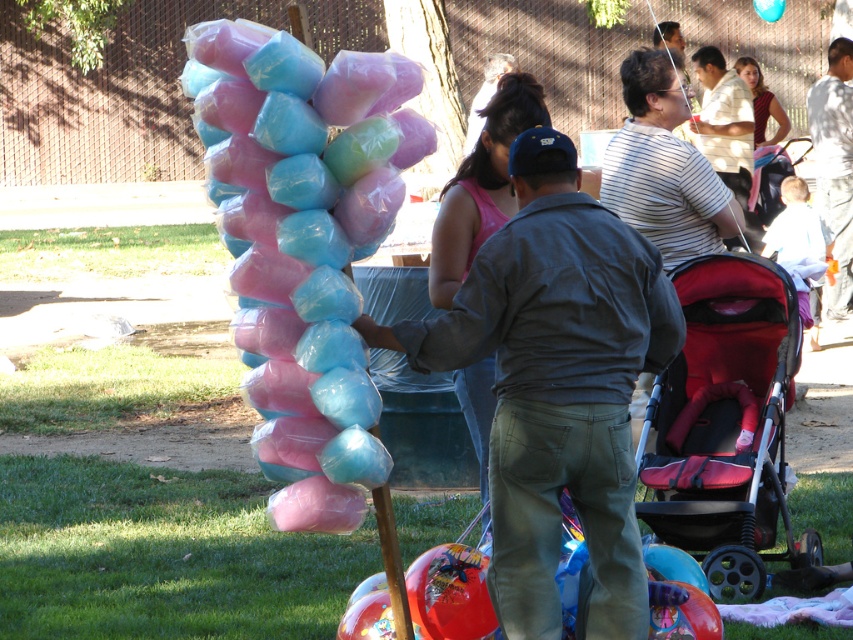
Who is positioned more to the right, velvet-like beige vest at upper right or blue glossy balloon at center?

From the viewer's perspective, blue glossy balloon at center appears more on the right side.

Is velvet-like beige vest at upper right thinner than blue glossy balloon at center?

In fact, velvet-like beige vest at upper right might be wider than blue glossy balloon at center.

Between point (753, 129) and point (775, 13), which one is positioned behind?

Positioned behind is point (775, 13).

Where is `velvet-like beige vest at upper right`? velvet-like beige vest at upper right is located at coordinates (761, 102).

Who is positioned more to the left, pastel cotton candy at center or matte gray shirt at center?

Positioned to the left is pastel cotton candy at center.

Between pastel cotton candy at center and matte gray shirt at center, which one is positioned lower?

matte gray shirt at center

Identify the location of pastel cotton candy at center. pos(305,246).

Can you confirm if pink fabric shirt at center is positioned to the left of velvet-like beige vest at upper right?

Correct, you'll find pink fabric shirt at center to the left of velvet-like beige vest at upper right.

Identify the location of pink fabric shirt at center. Image resolution: width=853 pixels, height=640 pixels. (480, 186).